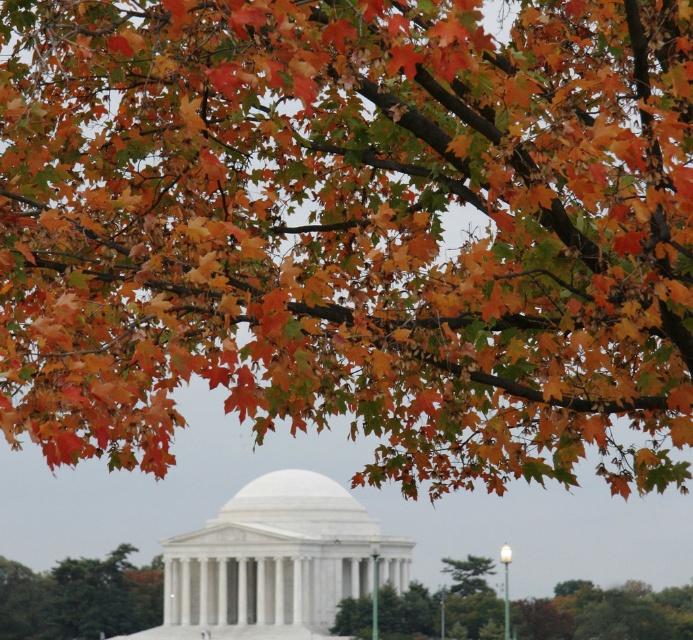
You are standing in a park and see the white marble gazebo at center and the green matte tree at lower left. Which object is positioned to the right side of the other?

The white marble gazebo at center is to the right of the green matte tree at lower left.

You are an architect evaluating the Jefferson Memorial scene. You need to determine if the green matte tree at lower left could block the view of the white marble gazebo at center from a visitor standing directly in front of the tree. Based on their heights, what is your assessment?

The white marble gazebo at center has a greater height compared to the green matte tree at lower left. Therefore, the tree at lower left is unlikely to block the view of the gazebo at center since the gazebo is taller than the tree.

You are a photographer planning to capture the Jefferson Memorial through the autumn foliage. Given the white marble gazebo at center and the green leafy tree at center, which object will appear larger in your photo?

The white marble gazebo at center is taller than the green leafy tree at center, so it will appear larger in the photo.